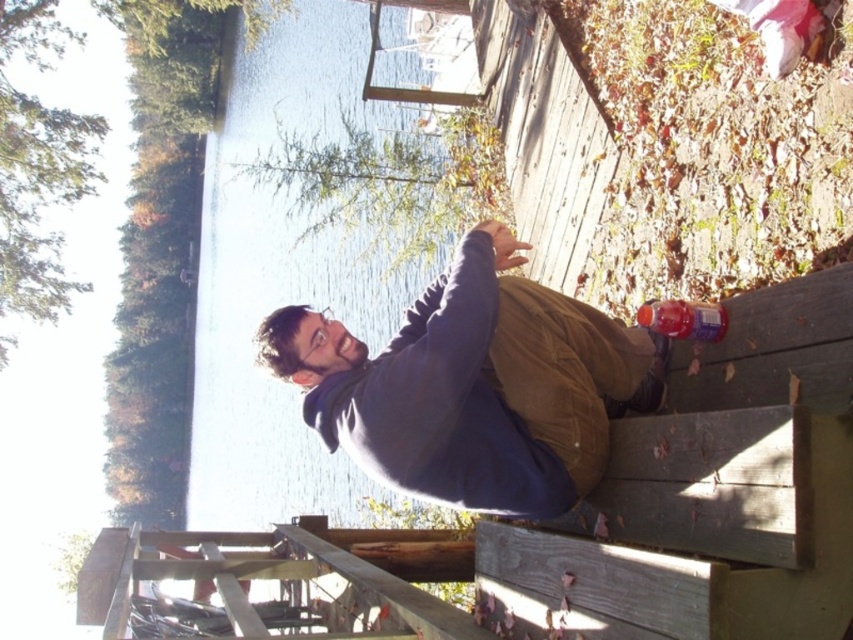
Between matte blue hoodie at center and translucent plastic bottle at lower right, which one appears on the left side from the viewer's perspective?

matte blue hoodie at center

Does matte blue hoodie at center have a greater height compared to translucent plastic bottle at lower right?

Yes.

Which is behind, point (582, 474) or point (695, 323)?

The point (695, 323) is behind.

Find the location of a particular element. The image size is (853, 640). matte blue hoodie at center is located at coordinates (474, 385).